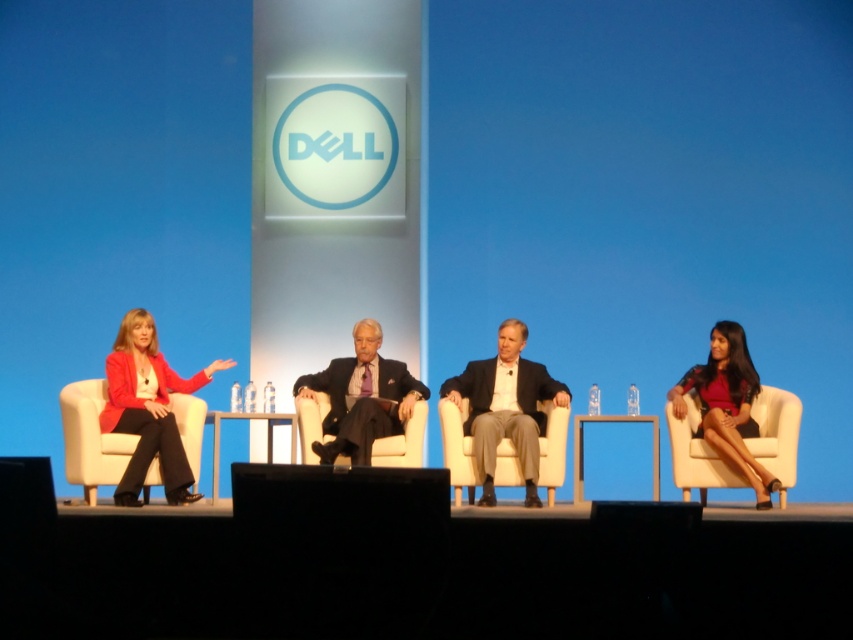
You are a stagehand preparing to adjust the seating for better visibility. You notice the beige fabric chair at center and the white fabric chair at center. Which chair should you lower to ensure all panelists have equal eye level during the discussion?

The beige fabric chair at center is much taller than the white fabric chair at center, so you should lower the beige fabric chair at center to ensure equal eye level for all panelists.

You are sitting in the audience watching the panel discussion. You want to know which chair is closer to the front of the stage between the white fabric chair at left and the white leather chair at right. Which one is closer?

The white fabric chair at left is closer to the viewer, so it is closer to the front of the stage than the white leather chair at right.